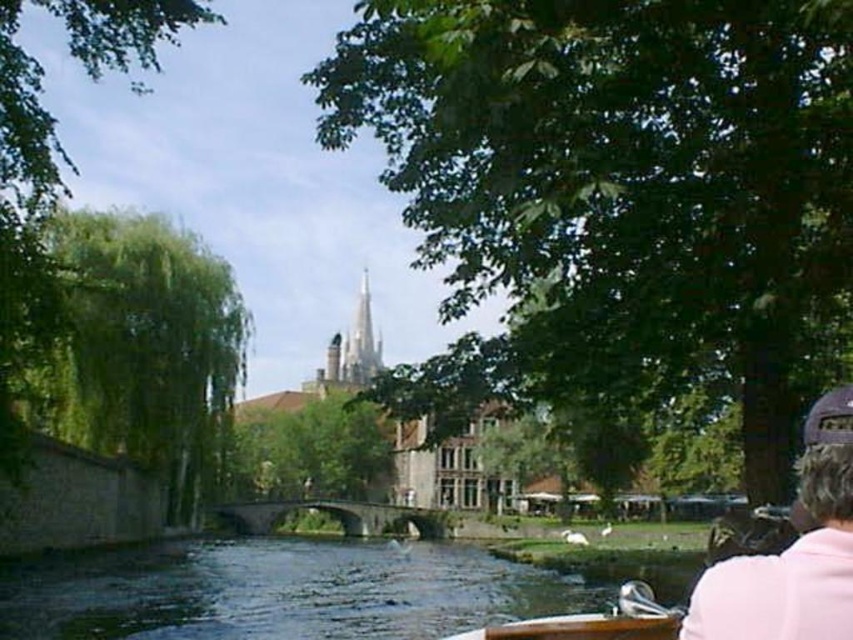
You are standing on the wooden boat at lower center and want to reach the pink fabric cap at upper right. The cap is 20.19 feet away. If your rowing speed is 2 feet per second, how many seconds will it take to reach the cap?

The distance between the wooden boat at lower center and the pink fabric cap at upper right is 20.19 feet. At a rowing speed of 2 feet per second, it would take 20.19 divided by 2, which equals approximately 10.095 seconds. Rounding to two decimal places, it would take about 10.10 seconds to reach the cap.

You are a photographer planning to take a picture of the dark green water at lower center and the pink fabric cap at upper right. Which object should you focus on first if you want to ensure both are in sharp focus?

You should focus on the dark green water at lower center first because it is taller than the pink fabric cap at upper right, so it will require a closer focus distance to maintain sharpness for both objects.

You are a photographer planning to capture the pink fabric cap at upper right and the wooden boat at lower center in the same frame. Given their sizes, which object should you zoom in on to ensure both fit comfortably in the photo?

Since the pink fabric cap at upper right is smaller than the wooden boat at lower center, you should zoom in on the wooden boat at lower center to ensure both objects fit comfortably in the photo.